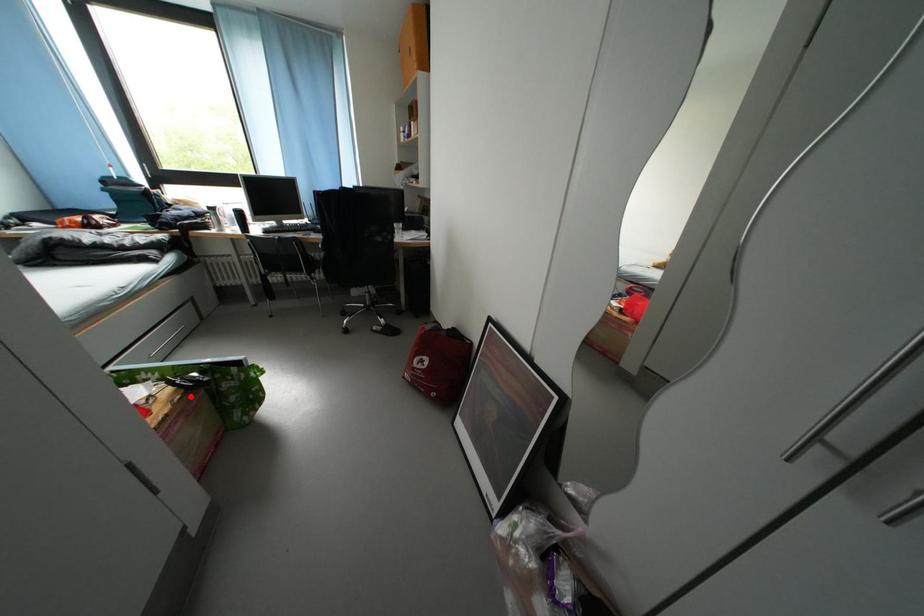
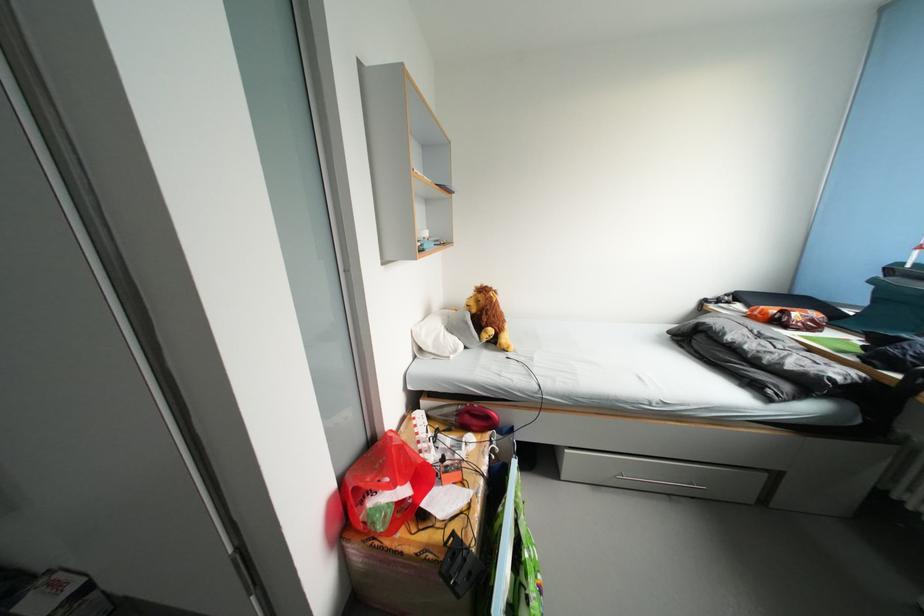
Question: I am providing you with two images of the same scene from different viewpoints. A red point is shown in image1. For the corresponding object point in image2, is it positioned nearer or farther from the camera?

Choices:
 (A) Nearer
 (B) Farther

Answer: (B)